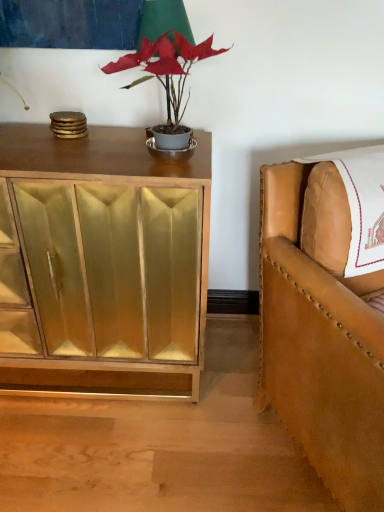
In order to click on vacant space underneath matte gray pot at center (from a real-world perspective) in this screenshot , I will do `click(156, 157)`.